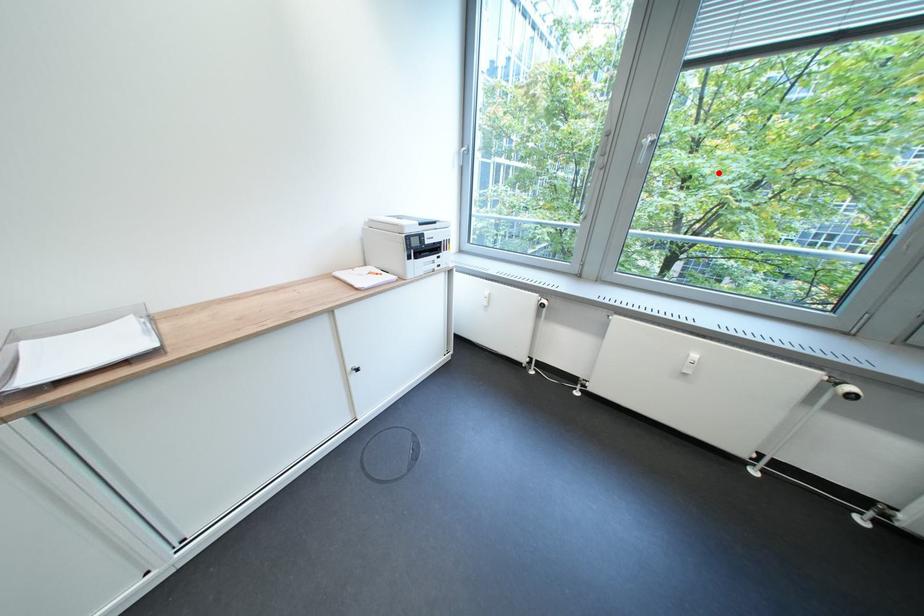
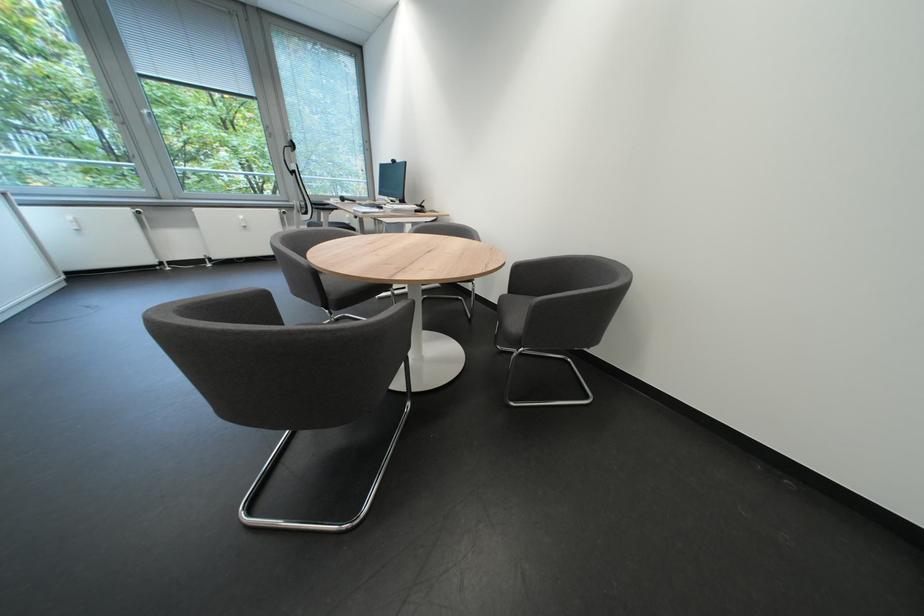
Locate, in the second image, the point that corresponds to the highlighted location in the first image.

(248, 146)